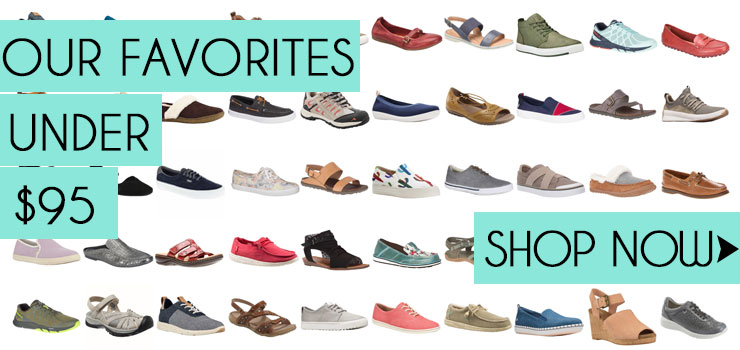
Find the location of a particular element. bottom row of shoes is located at coordinates (44, 322), (124, 317), (192, 312), (254, 316), (326, 313), (397, 313), (477, 321), (533, 321), (608, 324), (673, 317).